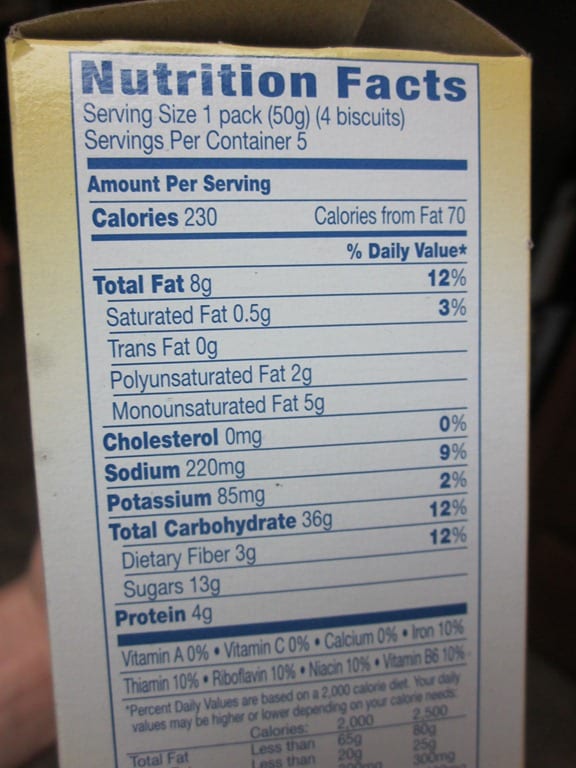
Locate an element on the screen. box is located at coordinates (500, 164).